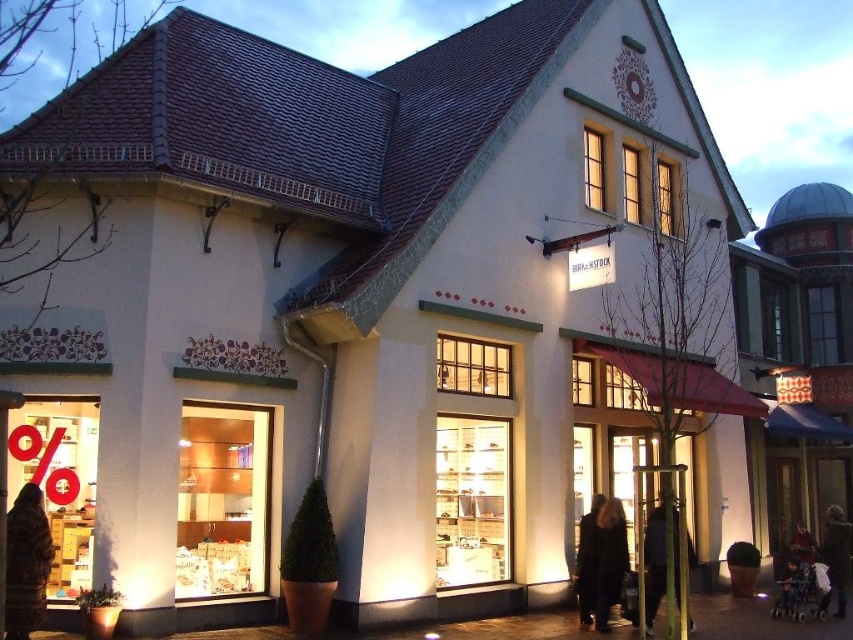
Question: Among these objects, which one is farthest from the camera?

Choices:
 (A) dark gray fabric coat at center
 (B) dark brown leather jacket at lower right

Answer: (B)

Question: Which point appears farthest from the camera in this image?

Choices:
 (A) (605, 524)
 (B) (589, 616)
 (C) (677, 541)

Answer: (A)

Question: Does dark gray fabric coat at center have a greater width compared to dark brown leather coat at center?

Choices:
 (A) no
 (B) yes

Answer: (B)

Question: Does dark brown leather jacket at lower right appear over dark brown leather coat at center?

Choices:
 (A) no
 (B) yes

Answer: (A)

Question: In this image, where is dark gray fabric coat at center located relative to dark gray fabric coat at lower right?

Choices:
 (A) left
 (B) right

Answer: (B)

Question: Estimate the real-world distances between objects in this image. Which object is farther from the dark brown leather jacket at lower right?

Choices:
 (A) brown textured coat at lower left
 (B) dark brown leather coat at center

Answer: (A)